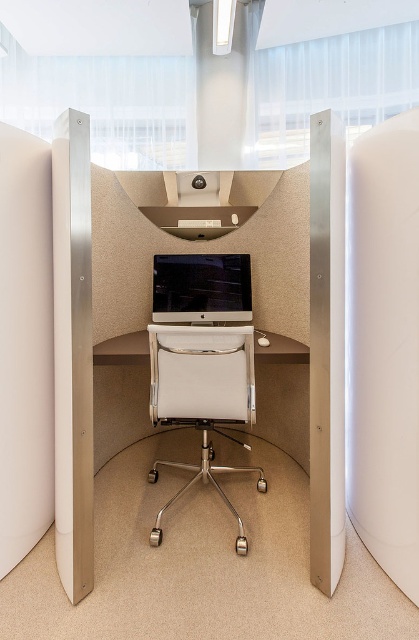
Question: Which object appears farthest from the camera in this image?

Choices:
 (A) matte beige desk at center
 (B) satin silver monitor at center
 (C) white leather swivel chair at center

Answer: (B)

Question: Can you confirm if matte beige desk at center is smaller than white leather swivel chair at center?

Choices:
 (A) yes
 (B) no

Answer: (A)

Question: Which object appears closest to the camera in this image?

Choices:
 (A) satin silver monitor at center
 (B) white leather swivel chair at center

Answer: (B)

Question: Can you confirm if white leather swivel chair at center is positioned above satin silver monitor at center?

Choices:
 (A) yes
 (B) no

Answer: (B)

Question: Which object is farther from the camera taking this photo?

Choices:
 (A) matte beige desk at center
 (B) satin silver monitor at center

Answer: (B)

Question: Does matte beige desk at center appear on the left side of white leather swivel chair at center?

Choices:
 (A) yes
 (B) no

Answer: (A)